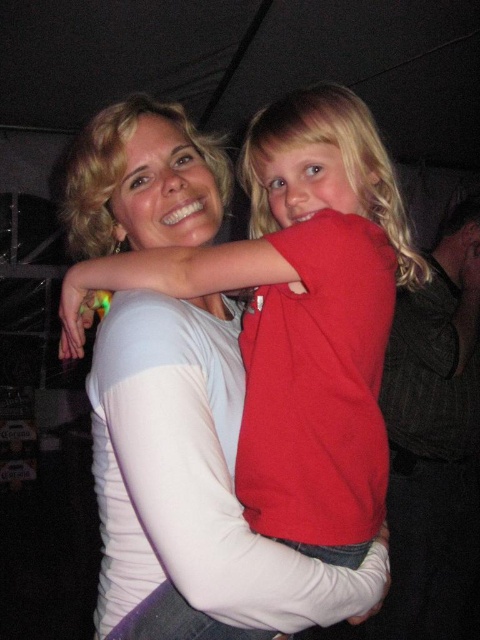
Looking at this image, you are a photographer trying to capture the scene between the two people. You notice the red matte shirt at center and the red cotton shirt at center. Which one is positioned to the left of the other?

The red matte shirt at center is to the left of the red cotton shirt at center.

You are a photographer trying to capture a candid shot of the two subjects in the scene. The camera you are using has a depth of field that can only focus clearly on objects within a 30 inch range. Given the distance between the red matte shirt at center and the red cotton shirt at center, will both shirts be in focus in the photo?

The distance between the red matte shirt at center and the red cotton shirt at center is 34.61 inches, which exceeds the camera lens depth of field range of 30 inches. Therefore, both shirts cannot be in focus simultaneously in the photo.

You are a photographer trying to capture a closeup of the red matte shirt at center and the red cotton shirt at center. Which one is closer to the camera?

The red matte shirt at center is in front of the red cotton shirt at center, so the red matte shirt at center is closer to the camera.